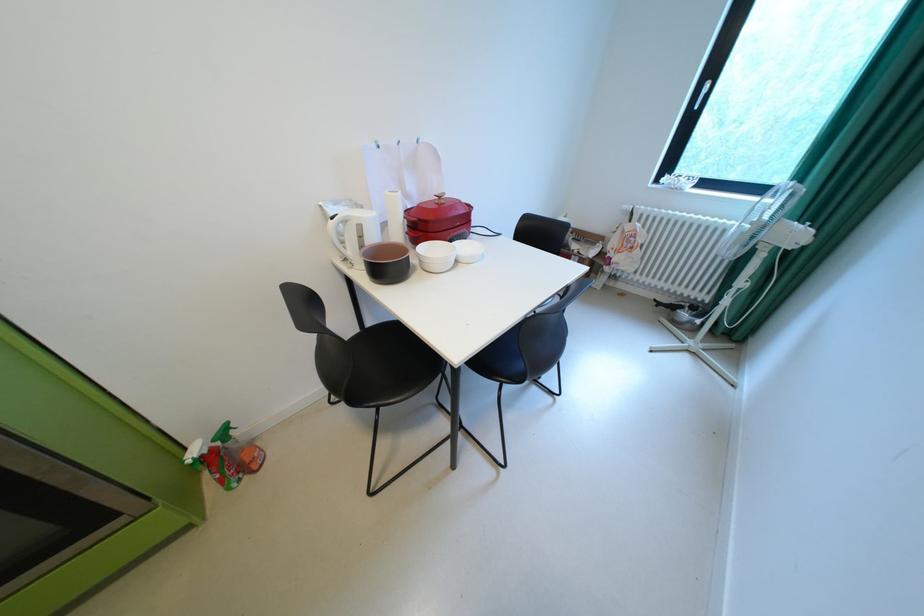
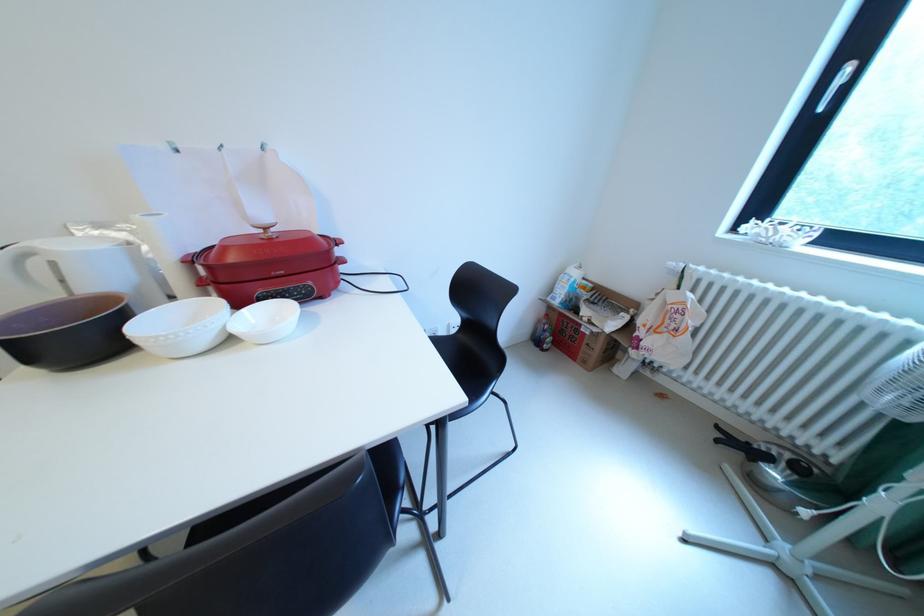
In a continuous first-person perspective shot, in which direction is the camera moving?

The cameraman walked toward right, forward.